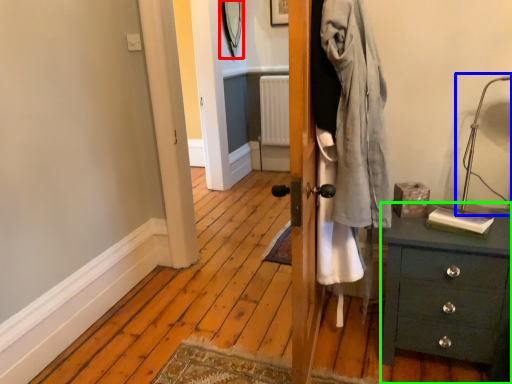
Question: Which object is the farthest from mirror (highlighted by a red box)? Choose among these: table lamp (highlighted by a blue box) or chest of drawers (highlighted by a green box).

Choices:
 (A) table lamp
 (B) chest of drawers

Answer: (B)